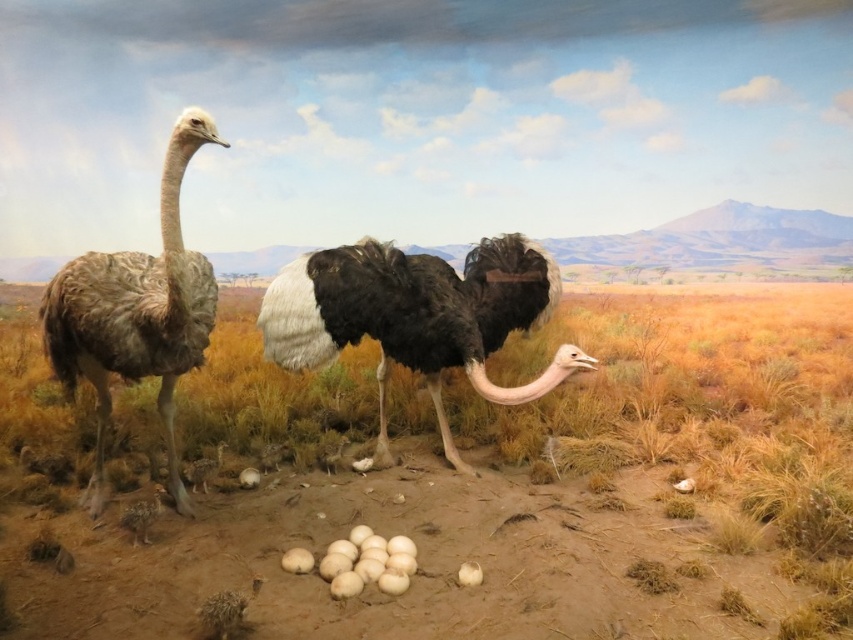
Question: Is brown sandy dirt at center to the right of black glossy feathers at center from the viewer's perspective?

Choices:
 (A) yes
 (B) no

Answer: (A)

Question: Does brown sandy dirt at center have a greater width compared to black glossy feathers at center?

Choices:
 (A) yes
 (B) no

Answer: (A)

Question: Does brown sandy dirt at center come behind brown feathered ostrich at left?

Choices:
 (A) yes
 (B) no

Answer: (A)

Question: Which of these objects is positioned farthest from the black glossy feathers at center?

Choices:
 (A) brown feathered ostrich at left
 (B) brown sandy dirt at center

Answer: (B)

Question: Considering the real-world distances, which object is closest to the brown sandy dirt at center?

Choices:
 (A) black glossy feathers at center
 (B) brown feathered ostrich at left

Answer: (A)

Question: Which of the following is the farthest from the observer?

Choices:
 (A) (434, 307)
 (B) (717, 552)
 (C) (166, 285)

Answer: (A)